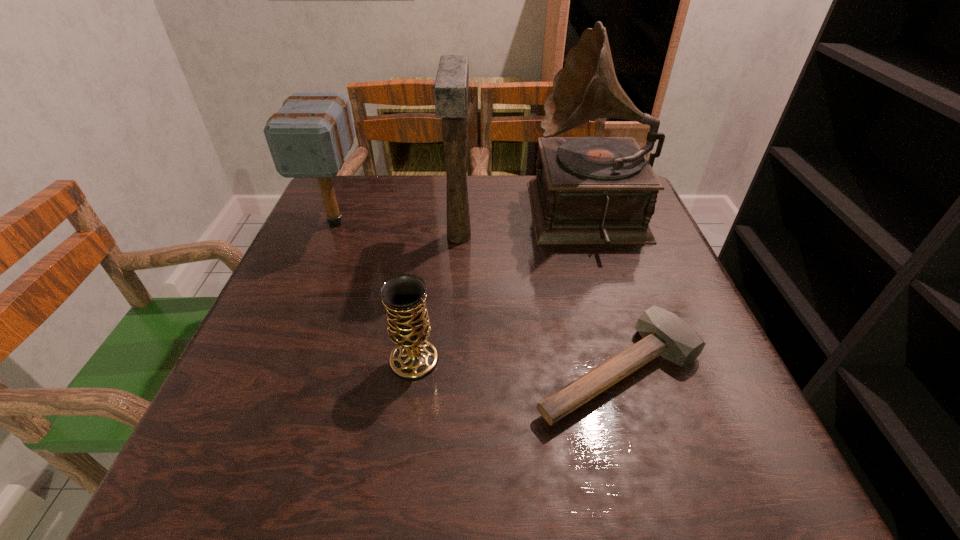
Image resolution: width=960 pixels, height=540 pixels. What are the coordinates of `vacant region located on the front of the tallest mallet` in the screenshot? It's located at (450, 379).

This screenshot has width=960, height=540. Identify the location of vacant point located on the striking surface of the second shortest mallet. (319, 263).

In order to click on vacant space located 0.090m on the front of the chalice in this screenshot , I will do `click(404, 429)`.

The height and width of the screenshot is (540, 960). I want to click on vacant space situated on the back of the shortest object, so click(x=586, y=255).

Where is `record player at the far edge`? This screenshot has height=540, width=960. record player at the far edge is located at coordinates (588, 190).

You are a GUI agent. You are given a task and a screenshot of the screen. Output one action in this format:
    pyautogui.click(x=<x>, y=<y>)
    Task: Click on the object that is at the left edge
    This screenshot has width=960, height=540.
    Given the screenshot: What is the action you would take?
    pyautogui.click(x=309, y=137)

You are a GUI agent. You are given a task and a screenshot of the screen. Output one action in this format:
    pyautogui.click(x=<x>, y=<y>)
    Task: Click on the record player located at the right edge
    
    Given the screenshot: What is the action you would take?
    pyautogui.click(x=588, y=190)

Identify the location of mallet at the right edge. (664, 333).

Image resolution: width=960 pixels, height=540 pixels. What are the coordinates of `object that is at the far left corner` in the screenshot? It's located at (309, 137).

This screenshot has width=960, height=540. I want to click on object that is at the far right corner, so click(588, 190).